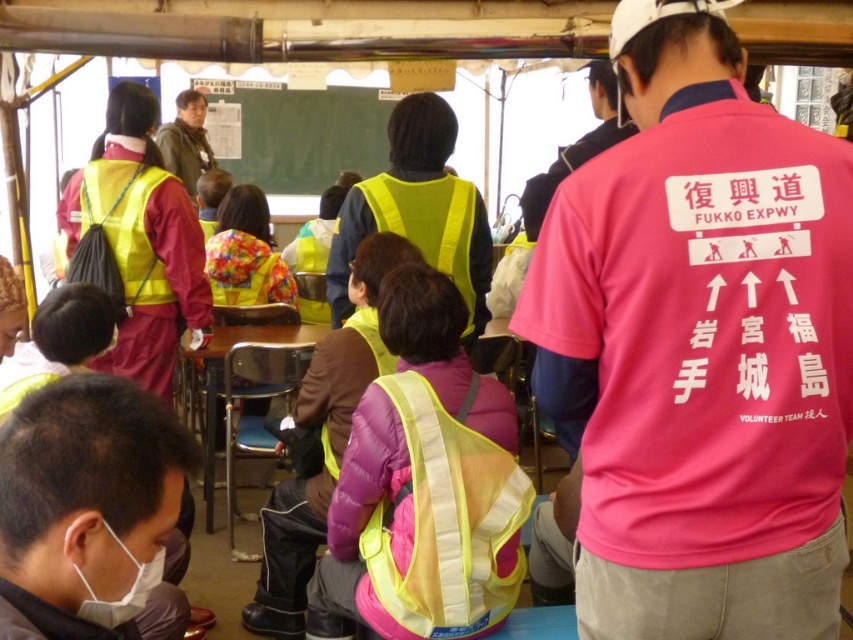
Is point (450, 460) less distant than point (210, 436)?

Yes, it is.

Who is more forward, (410, 456) or (212, 417)?

Point (410, 456) is more forward.

At what (x,y) coordinates should I click in order to perform the action: click on yellow mesh safety vest at center. Please return your answer as a coordinate pair (x, y). Looking at the image, I should click on (445, 522).

Does pink fabric shirt at center appear on the right side of yellow mesh safety vest at center?

Yes, pink fabric shirt at center is to the right of yellow mesh safety vest at center.

Can you confirm if pink fabric shirt at center is wider than yellow mesh safety vest at center?

Correct, the width of pink fabric shirt at center exceeds that of yellow mesh safety vest at center.

Is point (709, 224) closer to camera compared to point (451, 627)?

Yes, point (709, 224) is in front of point (451, 627).

Identify the location of pink fabric shirt at center. This screenshot has height=640, width=853. (700, 346).

How distant is high-visibility yellow vest at center from matte yellow safety vest at upper left?

38.67 inches

Who is taller, high-visibility yellow vest at center or matte yellow safety vest at upper left?

high-visibility yellow vest at center

Find the location of a particular element. The width and height of the screenshot is (853, 640). high-visibility yellow vest at center is located at coordinates (418, 209).